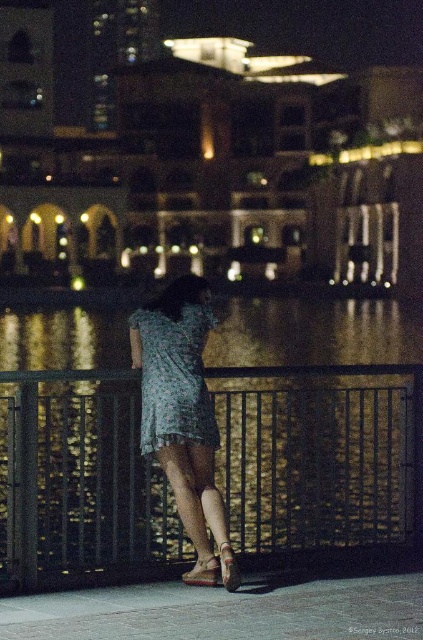
Question: Is printed fabric dress at center further to camera compared to brown leather sandal at lower center?

Choices:
 (A) yes
 (B) no

Answer: (A)

Question: Which object appears farthest from the camera in this image?

Choices:
 (A) green floral dress at center
 (B) leather textured sandal at lower center

Answer: (A)

Question: Which object is farther from the camera taking this photo?

Choices:
 (A) black metal fence at center
 (B) brown leather sandal at lower center

Answer: (A)

Question: Is printed fabric dress at center to the left of green floral dress at center from the viewer's perspective?

Choices:
 (A) yes
 (B) no

Answer: (A)

Question: Does black metal fence at center appear under leather textured sandal at lower center?

Choices:
 (A) no
 (B) yes

Answer: (A)

Question: Which object is the farthest from the leather textured sandal at lower center?

Choices:
 (A) brown leather sandal at lower center
 (B) printed fabric dress at center
 (C) green floral dress at center

Answer: (C)